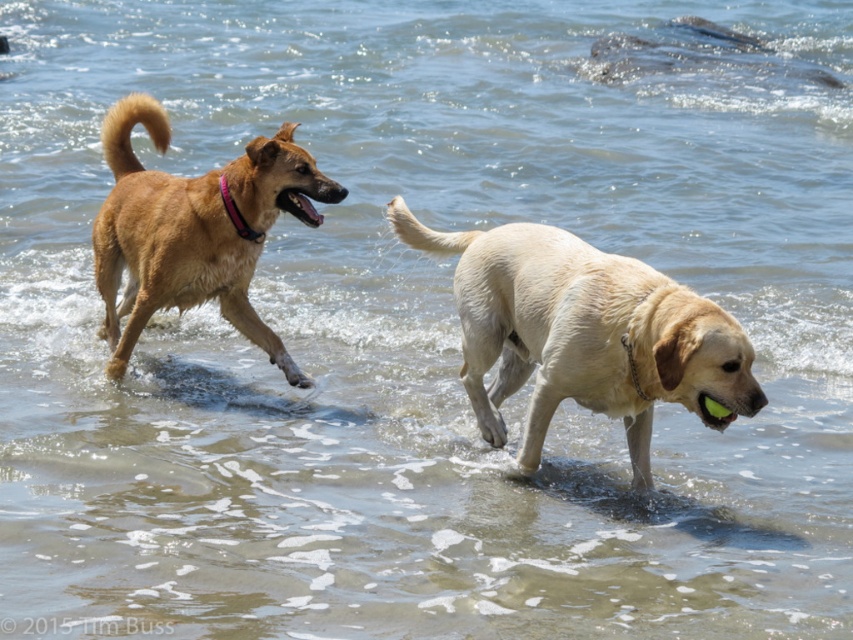
Question: Among these objects, which one is farthest from the camera?

Choices:
 (A) golden fur dog at center
 (B) brown furry dog at left

Answer: (B)

Question: Which point is closer to the camera?

Choices:
 (A) brown furry dog at left
 (B) golden fur dog at center

Answer: (B)

Question: Which point is closer to the camera taking this photo?

Choices:
 (A) (277, 189)
 (B) (596, 339)

Answer: (B)

Question: Is golden fur dog at center to the right of brown furry dog at left from the viewer's perspective?

Choices:
 (A) yes
 (B) no

Answer: (A)

Question: Can you confirm if golden fur dog at center is positioned above brown furry dog at left?

Choices:
 (A) yes
 (B) no

Answer: (B)

Question: Is golden fur dog at center wider than brown furry dog at left?

Choices:
 (A) yes
 (B) no

Answer: (A)